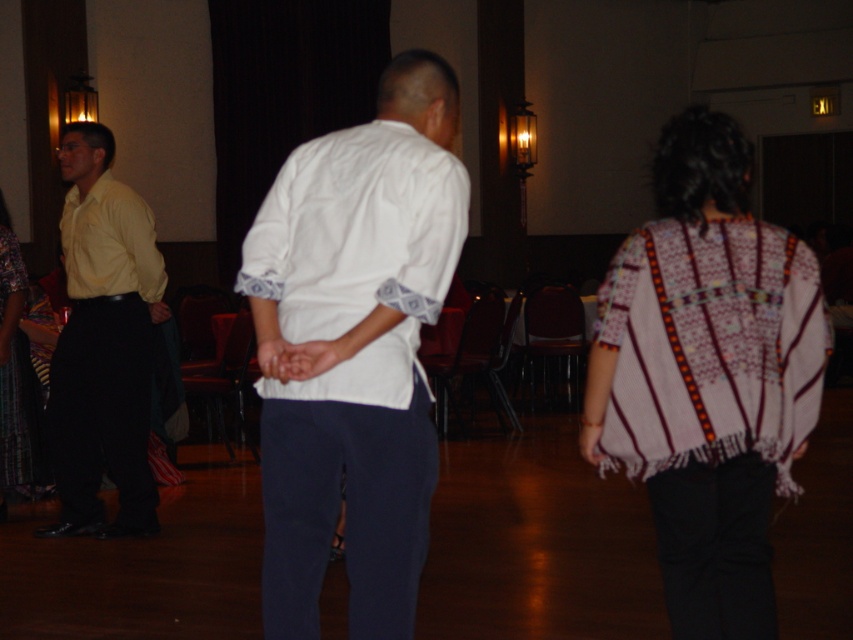
You are at the entrance of the hall and want to find the person wearing the white cotton shirt at center. According to the image, where should you look?

You should look at the point with coordinates 0.545 on the x axis and 0.416 on the y axis, which is the 2D location of the white cotton shirt at center in the image.

You are at the point marked as point (357, 252). Which object is exactly at this location?

The white cotton dress shirt at center is exactly at point (357, 252).

You are organizing a photo shoot and need to arrange two shirts on a mannequin. The white cotton shirt at center and the yellow matte shirt at left must be placed side by side. Which shirt should be placed on the right side to ensure they fit within a 1.2 meter wide display area?

The white cotton shirt at center has a lesser width compared to the yellow matte shirt at left. To fit within the 1.2 meter display area, the wider yellow matte shirt at left should be placed on the right side so that the narrower white cotton shirt at center can be positioned next to it without exceeding the total width.